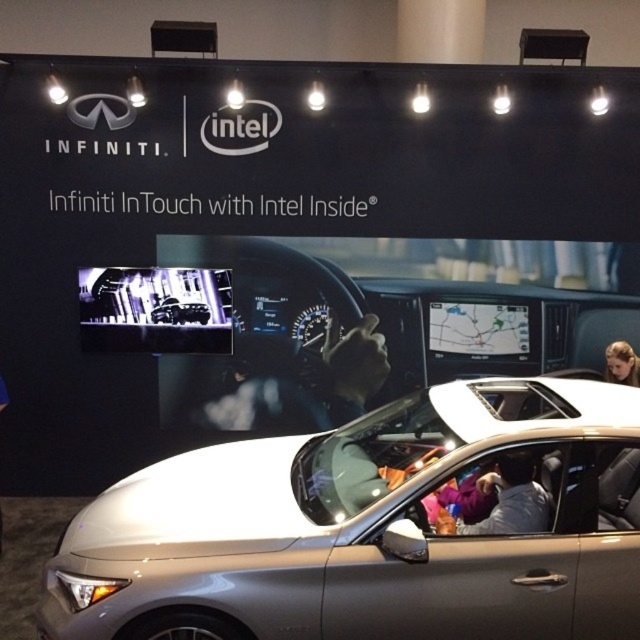
Question: Is satin silver car at center thinner than gray fabric jacket at center?

Choices:
 (A) yes
 (B) no

Answer: (B)

Question: Does gray fabric jacket at center lie behind blonde hair at upper right?

Choices:
 (A) yes
 (B) no

Answer: (B)

Question: Which point is closer to the camera?

Choices:
 (A) (436, 579)
 (B) (508, 506)
 (C) (624, 378)

Answer: (A)

Question: Which is farther from the satin silver car at center?

Choices:
 (A) gray fabric jacket at center
 (B) blonde hair at upper right

Answer: (B)

Question: Which is nearer to the blonde hair at upper right?

Choices:
 (A) satin silver car at center
 (B) gray fabric jacket at center

Answer: (A)

Question: Is satin silver car at center to the left of gray fabric jacket at center from the viewer's perspective?

Choices:
 (A) yes
 (B) no

Answer: (A)